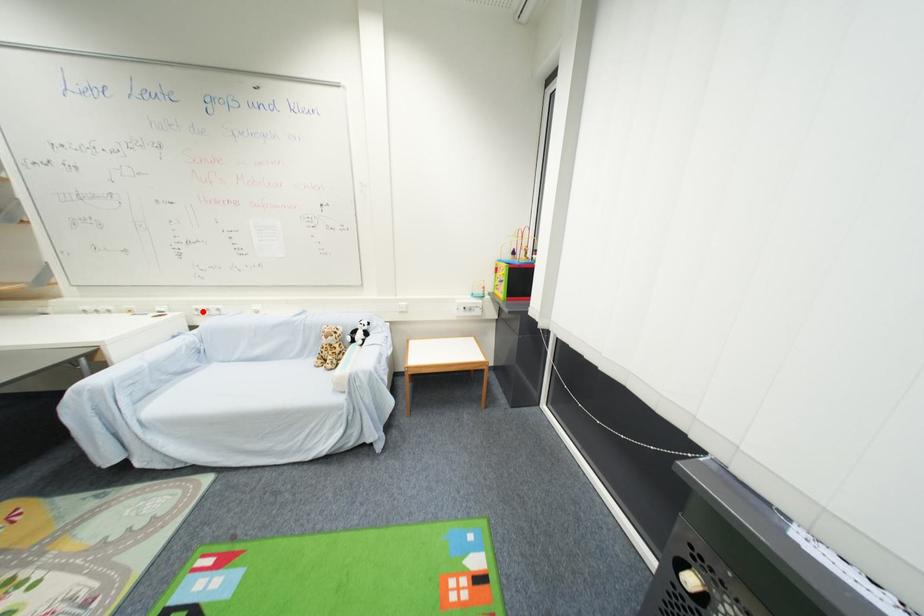
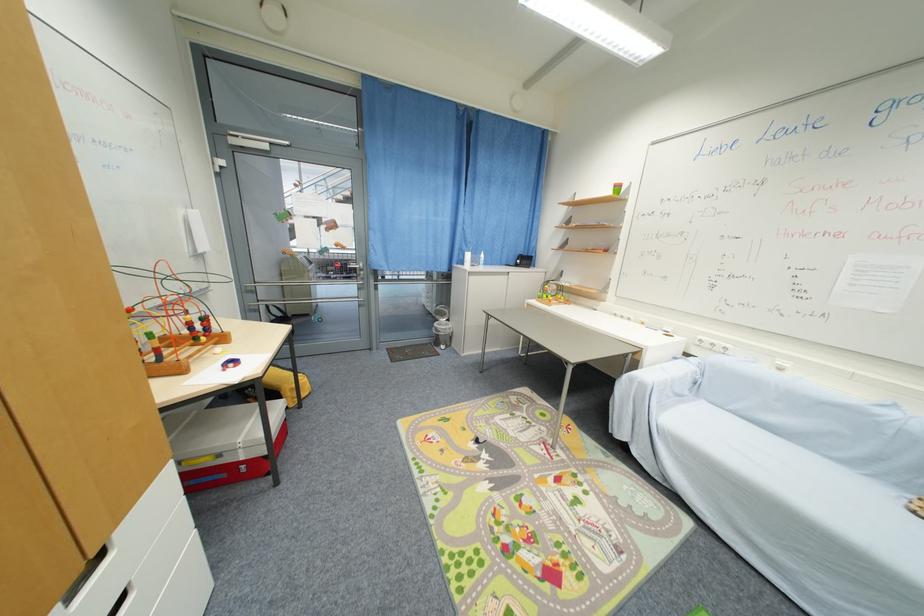
Question: I am providing you with two images of the same scene from different viewpoints. A red point is marked on the first image. At the location where the point appears in image 1, is it still visible in image 2?

Choices:
 (A) Yes
 (B) No

Answer: (A)